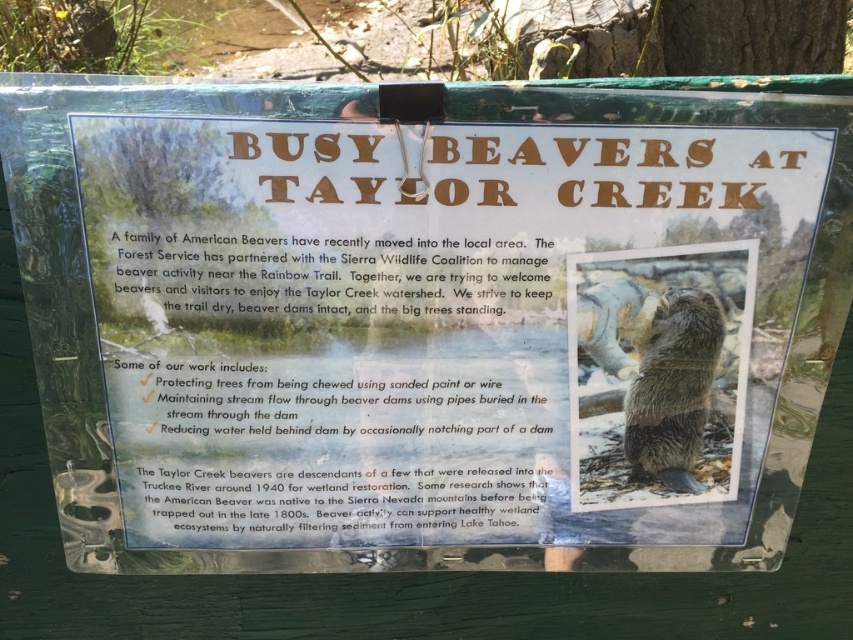
You are a park ranger who needs to install a new sign next to the existing one. The new sign must have a 2 cm gap between the fuzzy brown beaver at center and the fuzzy brown otter at center. Based on the current spacing between them, will you need to adjust their positions?

The fuzzy brown beaver at center and fuzzy brown otter at center are currently 1.62 centimeters apart. Since the required gap is 2 cm, which is larger than the current spacing, you will need to move them slightly apart to achieve the desired distance.

In the scene shown: You are a wildlife photographer aiming to capture both the fuzzy brown beaver at center and the fuzzy brown otter at center in a single frame. Based on their sizes, which animal should you focus on first to ensure they both fit in the photo?

The fuzzy brown beaver at center might be wider than the fuzzy brown otter at center, so focusing on the beaver first would help ensure both fit in the photo since it occupies more space.

You are a photographer standing at the Taylor Creek signboard. You want to take a photo of the fuzzy brown beaver at center so that it appears larger in the photo. Should you move closer or farther away from the signboard?

The fuzzy brown beaver at center is 38.49 inches from the camera. To make the beaver appear larger in the photo, you should move closer to the signboard, reducing the distance between the camera and the beaver.